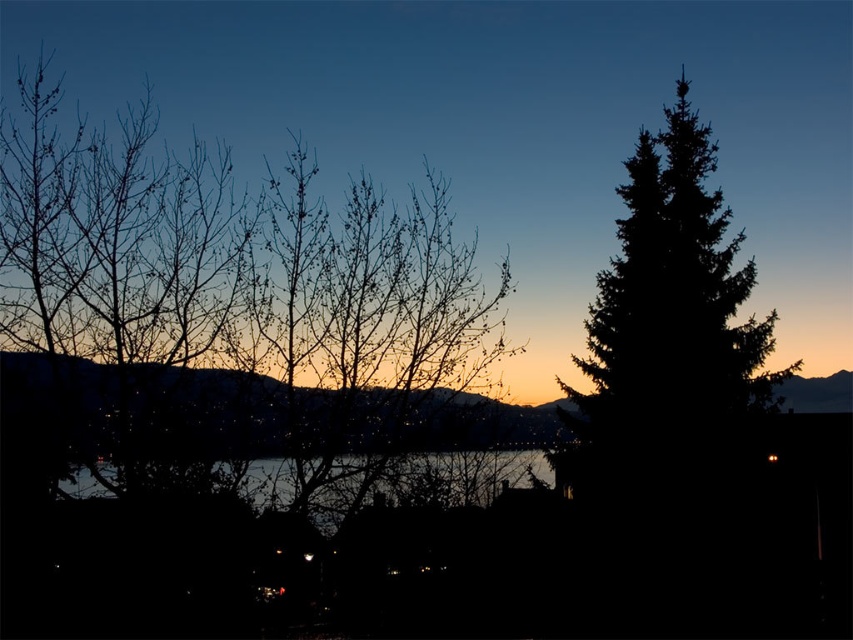
Question: Which object is farther from the camera taking this photo?

Choices:
 (A) transparent water at center
 (B) dark green textured tree at right

Answer: (B)

Question: Can you confirm if dark green textured tree at right is positioned to the right of transparent water at center?

Choices:
 (A) no
 (B) yes

Answer: (B)

Question: Can you confirm if dark green textured tree at right is positioned above transparent water at center?

Choices:
 (A) yes
 (B) no

Answer: (A)

Question: Does dark green textured tree at right have a smaller size compared to transparent water at center?

Choices:
 (A) no
 (B) yes

Answer: (B)

Question: Which object is closer to the camera taking this photo?

Choices:
 (A) dark green textured tree at right
 (B) transparent water at center

Answer: (B)